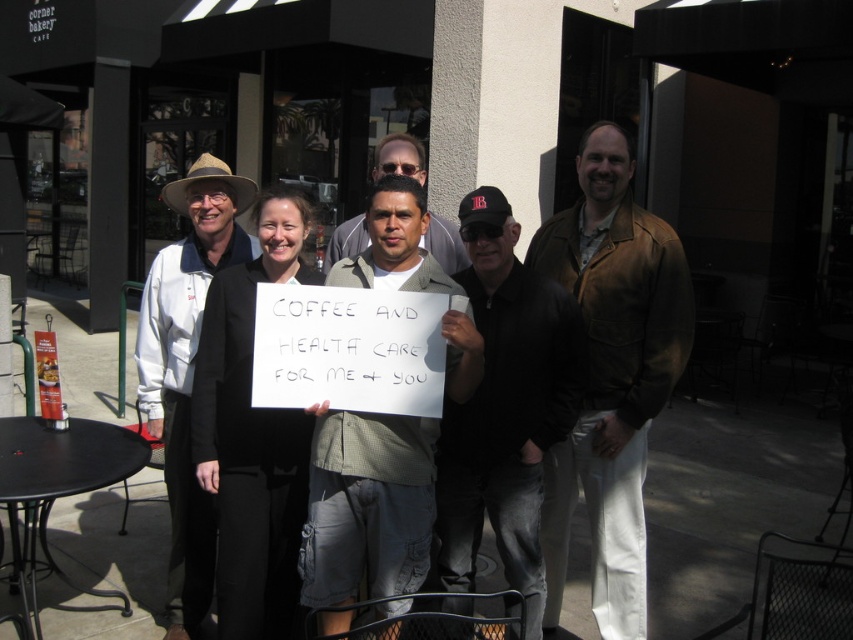
Is point (585, 417) positioned in front of point (486, 448)?

No, it is not.

Consider the image. Is brown leather jacket at center below black leather jacket at center?

Incorrect, brown leather jacket at center is not positioned below black leather jacket at center.

Image resolution: width=853 pixels, height=640 pixels. What are the coordinates of `brown leather jacket at center` in the screenshot? It's located at (611, 374).

This screenshot has height=640, width=853. What do you see at coordinates (611, 374) in the screenshot?
I see `brown leather jacket at center` at bounding box center [611, 374].

Based on the photo, is brown leather jacket at center wider than light brown textured shirt at center?

No, brown leather jacket at center is not wider than light brown textured shirt at center.

Image resolution: width=853 pixels, height=640 pixels. Describe the element at coordinates (611, 374) in the screenshot. I see `brown leather jacket at center` at that location.

The width and height of the screenshot is (853, 640). Identify the location of brown leather jacket at center. (611, 374).

Can you confirm if light brown cargo shorts at center is shorter than black fabric sign at center?

Yes.

Locate an element on the screen. light brown cargo shorts at center is located at coordinates (367, 506).